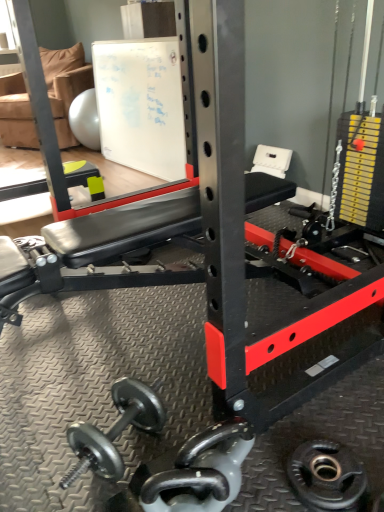
Where is `free space to the back side of polished silver dumbbell at center`? Image resolution: width=384 pixels, height=512 pixels. free space to the back side of polished silver dumbbell at center is located at coordinates (213, 424).